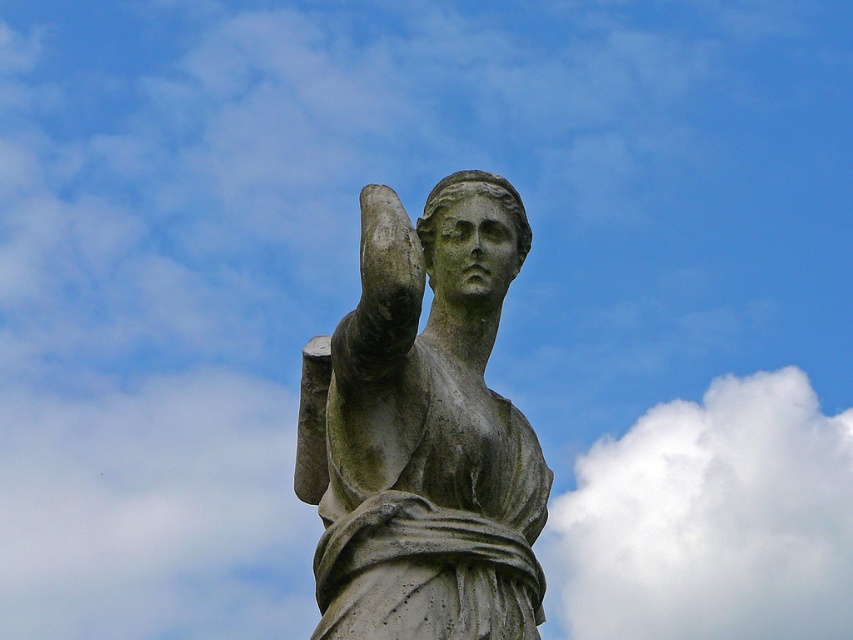
Is stone statue at center closer to the viewer compared to white fluffy cloud at upper center?

Yes, stone statue at center is closer to the viewer.

Does stone statue at center have a smaller size compared to white fluffy cloud at upper center?

Indeed, stone statue at center has a smaller size compared to white fluffy cloud at upper center.

Between point (445, 564) and point (548, 568), which one is positioned behind?

Positioned behind is point (548, 568).

This screenshot has height=640, width=853. What are the coordinates of `stone statue at center` in the screenshot? It's located at (422, 429).